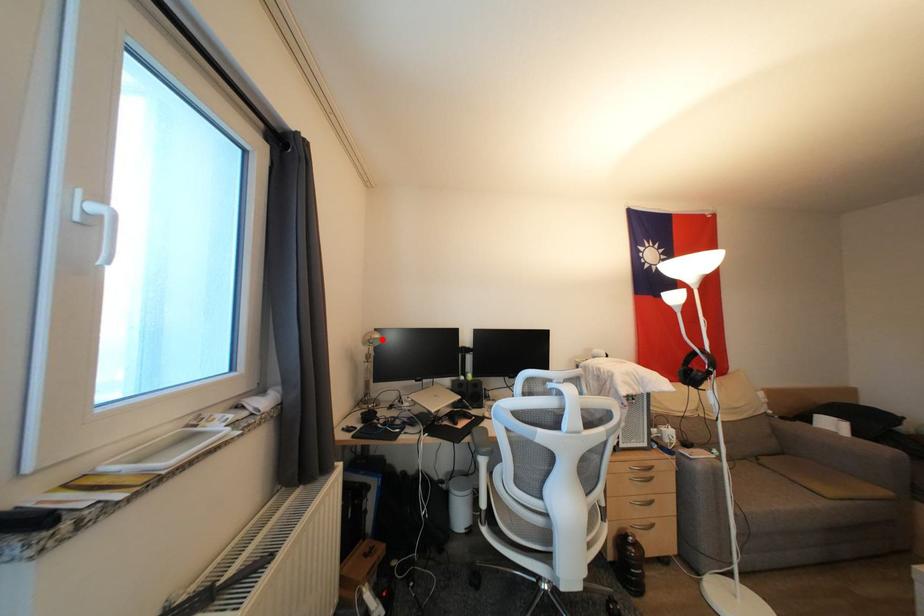
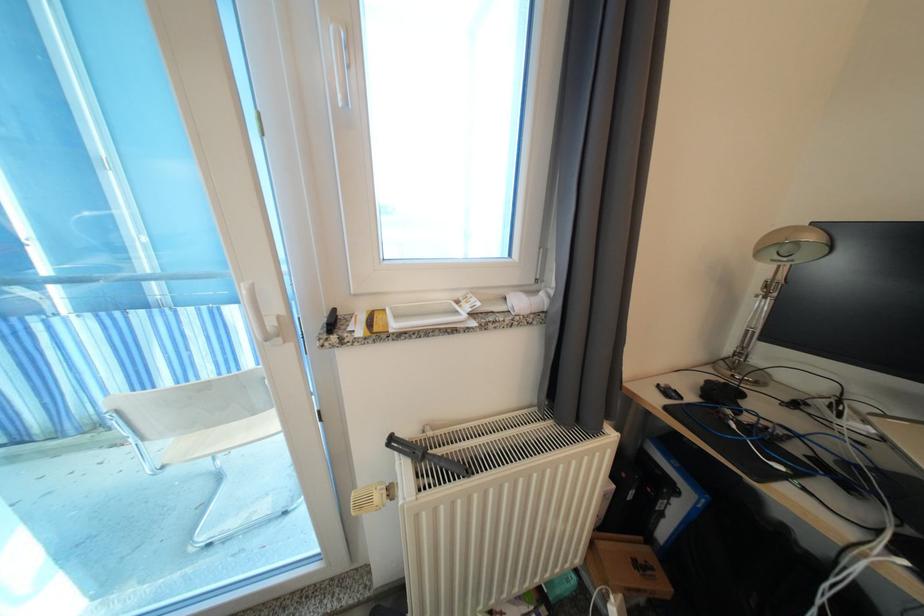
Where in the second image is the point corresponding to the highlighted location from the first image?

(818, 241)